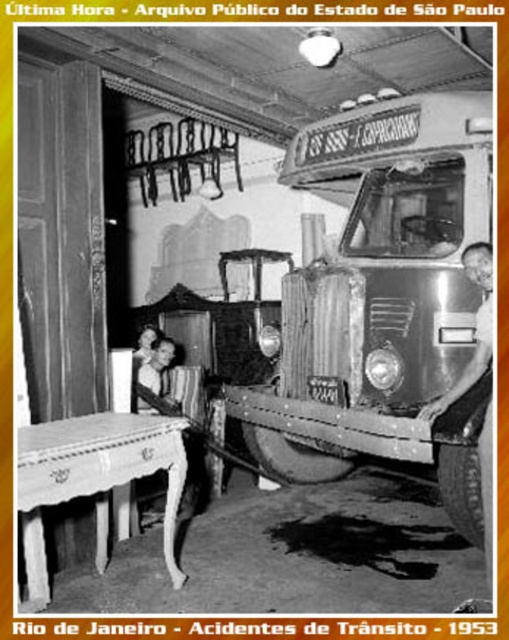
Is shiny silver fire truck at center wider than shiny silver truck at right?

Correct, the width of shiny silver fire truck at center exceeds that of shiny silver truck at right.

Between shiny silver fire truck at center and shiny silver truck at right, which one is positioned higher?

Positioned higher is shiny silver fire truck at center.

Is point (450, 380) less distant than point (466, 376)?

No, (450, 380) is further to viewer.

The image size is (509, 640). Find the location of `shiny silver fire truck at center`. shiny silver fire truck at center is located at coordinates [382, 300].

Which is more to the right, shiny silver fire truck at center or white wood table at lower left?

From the viewer's perspective, shiny silver fire truck at center appears more on the right side.

Identify the location of shiny silver fire truck at center. (382, 300).

I want to click on shiny silver fire truck at center, so point(382,300).

Is white wood table at lower left in front of shiny silver truck at right?

Yes, it is in front of shiny silver truck at right.

In the scene shown: Does white wood table at lower left have a greater height compared to shiny silver truck at right?

No.

The height and width of the screenshot is (640, 509). What do you see at coordinates (94, 477) in the screenshot? I see `white wood table at lower left` at bounding box center [94, 477].

At what (x,y) coordinates should I click in order to perform the action: click on white wood table at lower left. Please return your answer as a coordinate pair (x, y). Looking at the image, I should click on (94, 477).